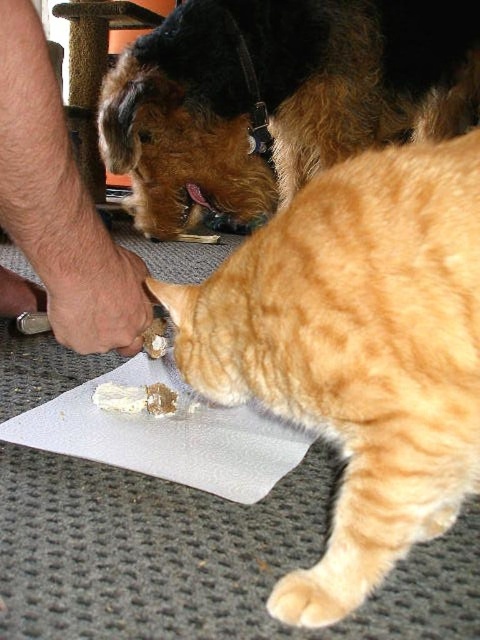
Question: Is orange fur cat at lower right wider than hair skin at lower left?

Choices:
 (A) no
 (B) yes

Answer: (B)

Question: Which object appears farthest from the camera in this image?

Choices:
 (A) hair skin at lower left
 (B) brown fur dog at upper center

Answer: (B)

Question: Does orange fur cat at lower right have a larger size compared to brown fur dog at upper center?

Choices:
 (A) no
 (B) yes

Answer: (A)

Question: Which of the following is the closest to the observer?

Choices:
 (A) (364, 42)
 (B) (107, 388)

Answer: (B)

Question: Which point appears closest to the camera in this image?

Choices:
 (A) (420, 84)
 (B) (145, 392)
 (C) (1, 116)
 (D) (369, 204)

Answer: (C)

Question: Does brown fur dog at upper center have a greater width compared to white creamy food at center?

Choices:
 (A) no
 (B) yes

Answer: (B)